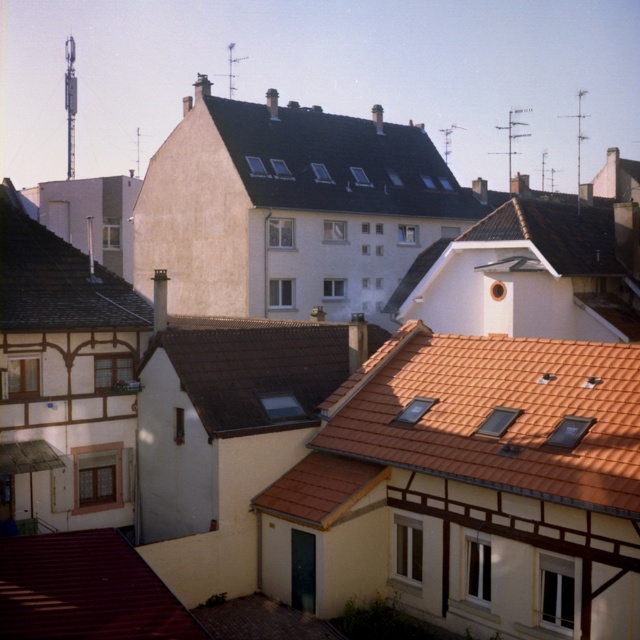
Question: Which point is closer to the camera taking this photo?

Choices:
 (A) (93, 308)
 (B) (19, 541)
 (C) (620, 396)
 (D) (188, 385)

Answer: (B)

Question: Which point is farther to the camera?

Choices:
 (A) (193, 317)
 (B) (51, 230)

Answer: (B)

Question: Is brown tile roof at center positioned behind gray slate roof at upper left?

Choices:
 (A) no
 (B) yes

Answer: (A)

Question: Observing the image, what is the correct spatial positioning of metallic red roof at lower left in reference to gray slate roof at upper left?

Choices:
 (A) above
 (B) below

Answer: (B)

Question: Can you confirm if metallic red roof at lower left is smaller than gray slate roof at upper left?

Choices:
 (A) no
 (B) yes

Answer: (B)

Question: Which of the following is the farthest from the observer?

Choices:
 (A) gray slate roof at upper left
 (B) brown tile roof at center

Answer: (A)